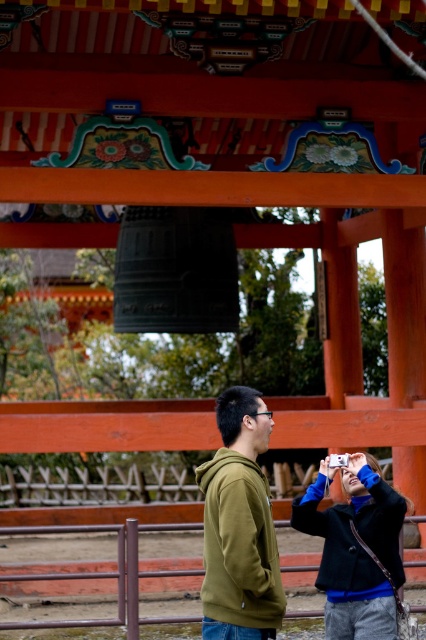
Measure the distance between green matte hoodie at center and dark blue textured jacket at lower right.

green matte hoodie at center is 37.94 inches from dark blue textured jacket at lower right.

Is green matte hoodie at center shorter than dark blue textured jacket at lower right?

Incorrect, green matte hoodie at center's height does not fall short of dark blue textured jacket at lower right's.

What do you see at coordinates (239, 525) in the screenshot? This screenshot has height=640, width=426. I see `green matte hoodie at center` at bounding box center [239, 525].

Identify the location of green matte hoodie at center. The width and height of the screenshot is (426, 640). (239, 525).